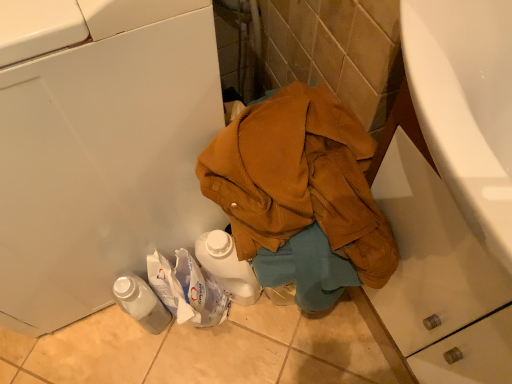
I want to click on brown corduroy jacket at center, so click(300, 180).

You are a GUI agent. You are given a task and a screenshot of the screen. Output one action in this format:
    pyautogui.click(x=<x>, y=<y>)
    Task: Click on the white plastic washing machine at lower left
    Image resolution: width=512 pixels, height=384 pixels.
    Given the screenshot: What is the action you would take?
    pyautogui.click(x=104, y=156)

You are a GUI agent. You are given a task and a screenshot of the screen. Output one action in this format:
    pyautogui.click(x=<x>, y=<y>)
    Task: Click on the translucent plastic bottle at lower left
    
    Given the screenshot: What is the action you would take?
    pyautogui.click(x=141, y=303)

Is white plastic washing machine at lower left bigger than brown corduroy jacket at center?

Yes, white plastic washing machine at lower left is bigger than brown corduroy jacket at center.

From the image's perspective, does white plastic washing machine at lower left appear lower than brown corduroy jacket at center?

Incorrect, from the image's perspective, white plastic washing machine at lower left is higher than brown corduroy jacket at center.

Which is behind, white plastic washing machine at lower left or brown corduroy jacket at center?

Positioned behind is brown corduroy jacket at center.

From a real-world perspective, is translucent plastic bottle at lower left physically below white plastic washing machine at lower left?

Yes, from a real-world perspective, translucent plastic bottle at lower left is beneath white plastic washing machine at lower left.

Considering the relative sizes of translucent plastic bottle at lower left and white plastic washing machine at lower left in the image provided, is translucent plastic bottle at lower left taller than white plastic washing machine at lower left?

No.

Is translucent plastic bottle at lower left far away from white plastic washing machine at lower left?

They are positioned close to each other.

At what (x,y) coordinates should I click in order to perform the action: click on bottle on the right side of white plastic washing machine at lower left. Please return your answer as a coordinate pair (x, y). This screenshot has height=384, width=512. Looking at the image, I should click on (141, 303).

From the image's perspective, would you say translucent plastic bottle at lower left is positioned over brown corduroy jacket at center?

No, from the image's perspective, translucent plastic bottle at lower left is not over brown corduroy jacket at center.

Consider the image. How many degrees apart are the facing directions of translucent plastic bottle at lower left and brown corduroy jacket at center?

translucent plastic bottle at lower left and brown corduroy jacket at center are facing 0.345 degrees away from each other.

Is translucent plastic bottle at lower left aimed at brown corduroy jacket at center?

No, translucent plastic bottle at lower left does not turn towards brown corduroy jacket at center.

Is translucent plastic bottle at lower left not near brown corduroy jacket at center?

Actually, translucent plastic bottle at lower left and brown corduroy jacket at center are a little close together.

Is the depth of brown corduroy jacket at center greater than that of white plastic washing machine at lower left?

Yes.

In the image, is brown corduroy jacket at center on the left side or the right side of white plastic washing machine at lower left?

Based on their positions, brown corduroy jacket at center is located to the right of white plastic washing machine at lower left.

How different are the orientations of brown corduroy jacket at center and white plastic washing machine at lower left in degrees?

The angular difference between brown corduroy jacket at center and white plastic washing machine at lower left is 0.000317 degrees.

From the image's perspective, is white plastic washing machine at lower left located above translucent plastic bottle at lower left?

Yes.

From a real-world perspective, is white plastic washing machine at lower left positioned above or below translucent plastic bottle at lower left?

From a real-world perspective, white plastic washing machine at lower left is physically above translucent plastic bottle at lower left.

Is white plastic washing machine at lower left oriented away from translucent plastic bottle at lower left?

No, white plastic washing machine at lower left is not facing the opposite direction of translucent plastic bottle at lower left.

From a real-world perspective, is brown corduroy jacket at center positioned over translucent plastic bottle at lower left based on gravity?

Yes, from a real-world perspective, brown corduroy jacket at center is over translucent plastic bottle at lower left

Consider the image. Is brown corduroy jacket at center facing towards translucent plastic bottle at lower left?

Yes, brown corduroy jacket at center is aimed at translucent plastic bottle at lower left.

How many degrees apart are the facing directions of brown corduroy jacket at center and translucent plastic bottle at lower left?

brown corduroy jacket at center and translucent plastic bottle at lower left are facing 0.345 degrees away from each other.

Between point (265, 176) and point (139, 311), which one is positioned in front?

The point (265, 176) is closer to the camera.

I want to click on washing machine that appears on the left of brown corduroy jacket at center, so tap(104, 156).

The width and height of the screenshot is (512, 384). Identify the location of bottle below the white plastic washing machine at lower left (from the image's perspective). (141, 303).

Considering their positions, is white plastic washing machine at lower left positioned closer to brown corduroy jacket at center than translucent plastic bottle at lower left?

The object closer to brown corduroy jacket at center is white plastic washing machine at lower left.

Based on their spatial positions, is brown corduroy jacket at center or translucent plastic bottle at lower left further from white plastic washing machine at lower left?

translucent plastic bottle at lower left.

Estimate the real-world distances between objects in this image. Which object is further from translucent plastic bottle at lower left, white plastic washing machine at lower left or brown corduroy jacket at center?

brown corduroy jacket at center.

Looking at the image, which one is located further to brown corduroy jacket at center, translucent plastic bottle at lower left or white plastic washing machine at lower left?

The object further to brown corduroy jacket at center is translucent plastic bottle at lower left.

Based on their spatial positions, is translucent plastic bottle at lower left or brown corduroy jacket at center further from white plastic washing machine at lower left?

translucent plastic bottle at lower left is further to white plastic washing machine at lower left.

Based on their spatial positions, is brown corduroy jacket at center or white plastic washing machine at lower left closer to translucent plastic bottle at lower left?

white plastic washing machine at lower left is positioned closer to the anchor translucent plastic bottle at lower left.

At what (x,y) coordinates should I click in order to perform the action: click on waste between white plastic washing machine at lower left and translucent plastic bottle at lower left from front to back. Please return your answer as a coordinate pair (x, y). Looking at the image, I should click on (300, 180).